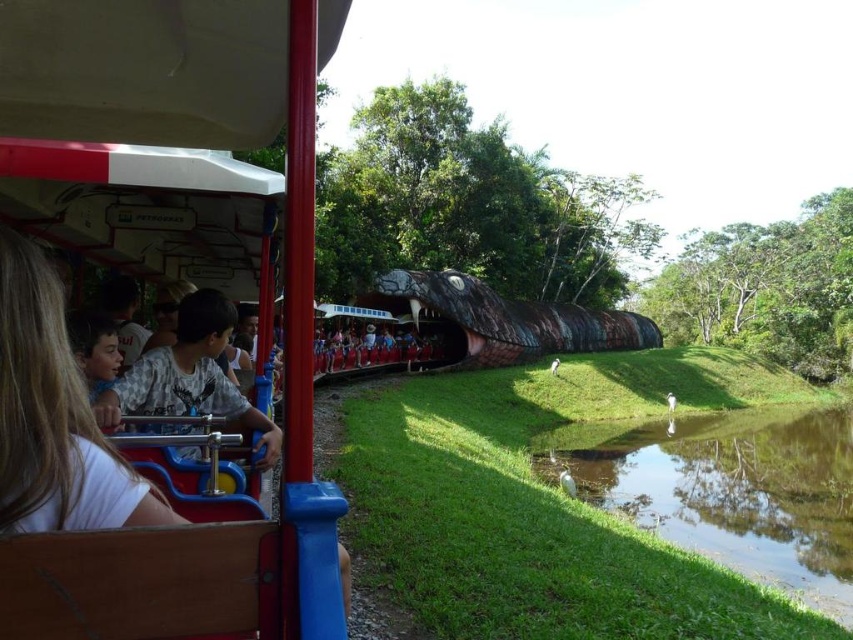
You are a passenger sitting in the train car with a red and white roof. You notice the green grassy river at lower right and the white matte shirt at left. Which object is closer to you?

The green grassy river at lower right is further to the viewer than the white matte shirt at left, so the white matte shirt at left is closer to you.

You are standing near the train track in the theme park scene. You see a white matte shirt at left. If you want to reach the shirt quickly, should you walk towards the train or away from it?

The white matte shirt at left is 2.22 meters away from the viewer. Since the shirt is already close, you should walk towards it to reach it quickly.